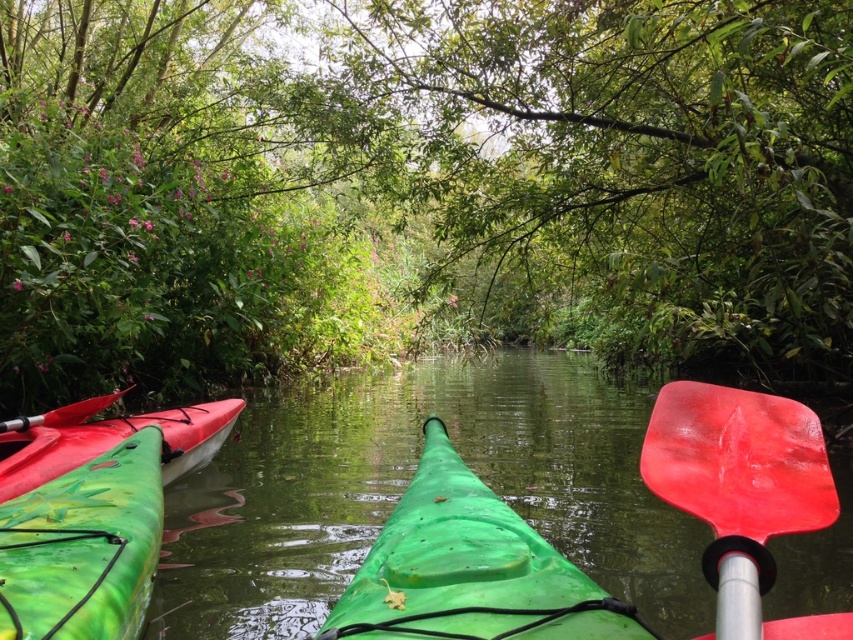
Question: Which is farther from the green matte kayak at lower left?

Choices:
 (A) green rubber canoe at center
 (B) green plastic kayak at center
 (C) green matte kayak at left
 (D) green matte tree at center

Answer: (D)

Question: Can you confirm if green plastic kayak at center is positioned to the right of red matte paddle at center?

Choices:
 (A) no
 (B) yes

Answer: (A)

Question: Which point is closer to the camera?

Choices:
 (A) green rubber canoe at center
 (B) green matte kayak at lower left
 (C) green matte tree at center

Answer: (A)

Question: Which point is farther to the camera?

Choices:
 (A) green matte tree at center
 (B) green rubber canoe at center
 (C) red matte paddle at center
 (D) green plastic kayak at center

Answer: (A)

Question: Does green matte tree at center lie behind red matte paddle at center?

Choices:
 (A) yes
 (B) no

Answer: (A)

Question: Can you confirm if green matte kayak at left is thinner than matte red paddle at left?

Choices:
 (A) yes
 (B) no

Answer: (B)